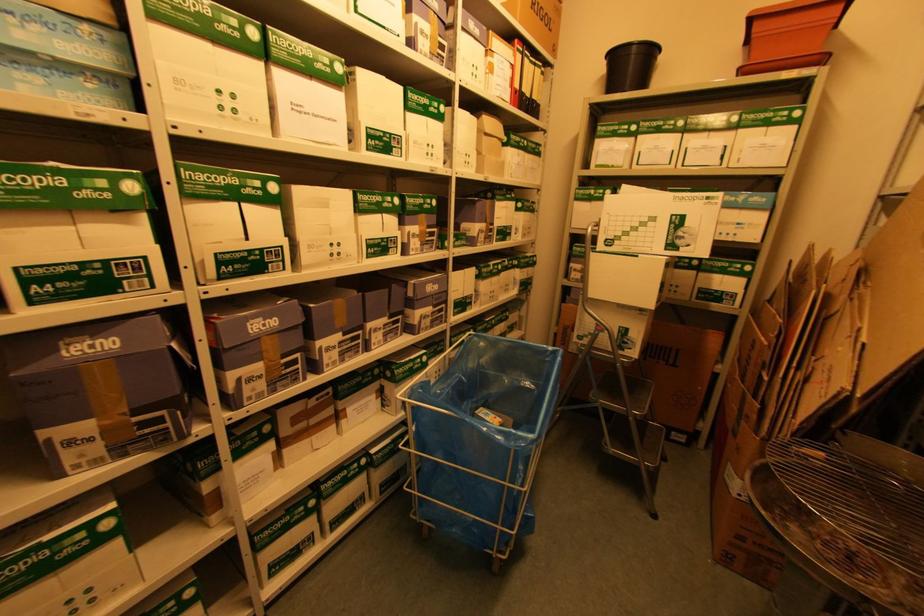
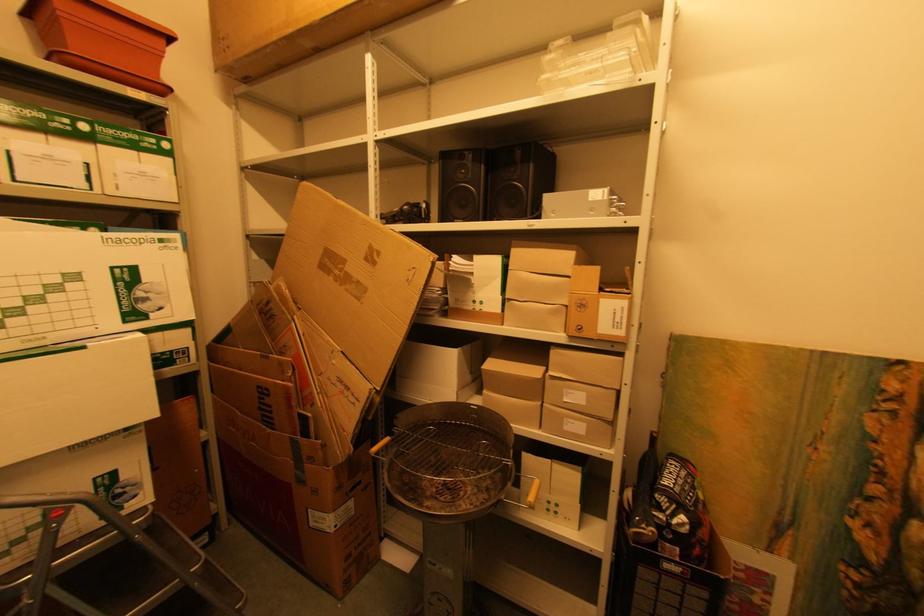
Question: How did the camera likely rotate?

Choices:
 (A) Left
 (B) Right
 (C) Up
 (D) Down

Answer: (B)